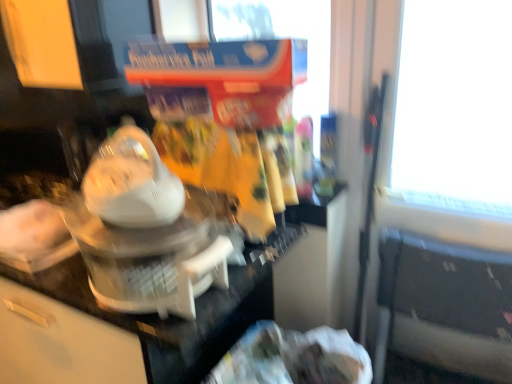
Question: Does point (147, 233) appear closer or farther from the camera than point (471, 319)?

Choices:
 (A) farther
 (B) closer

Answer: (B)

Question: Based on their positions, is white plastic blender at center located to the left or right of black plastic chair at lower right?

Choices:
 (A) right
 (B) left

Answer: (B)

Question: Which of these objects is positioned farthest from the white plastic blender at center?

Choices:
 (A) white glossy counter top at center
 (B) black plastic chair at lower right

Answer: (B)

Question: Based on their relative distances, which object is nearer to the black plastic chair at lower right?

Choices:
 (A) white glossy counter top at center
 (B) white plastic blender at center

Answer: (A)